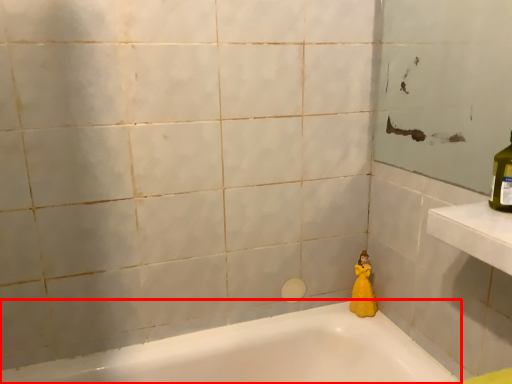
Question: From the image, what is the correct spatial relationship of bathtub (annotated by the red box) in relation to doll?

Choices:
 (A) left
 (B) right

Answer: (A)